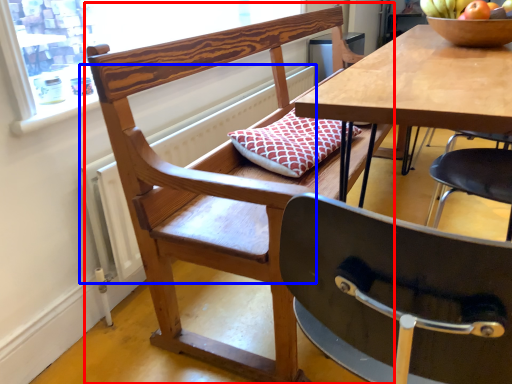
Question: Which object appears farthest to the camera in this image, chair (highlighted by a red box) or radiator (highlighted by a blue box)?

Choices:
 (A) chair
 (B) radiator

Answer: (B)